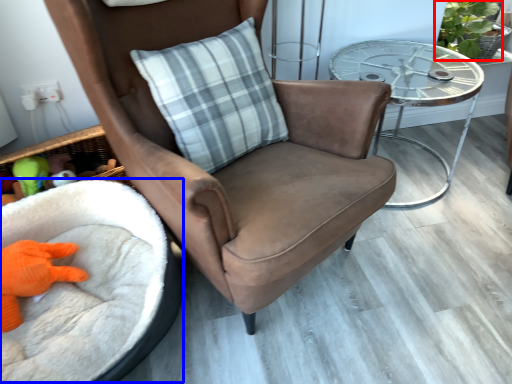
Question: Which object appears closest to the camera in this image, plant (highlighted by a red box) or infant bed (highlighted by a blue box)?

Choices:
 (A) plant
 (B) infant bed

Answer: (B)